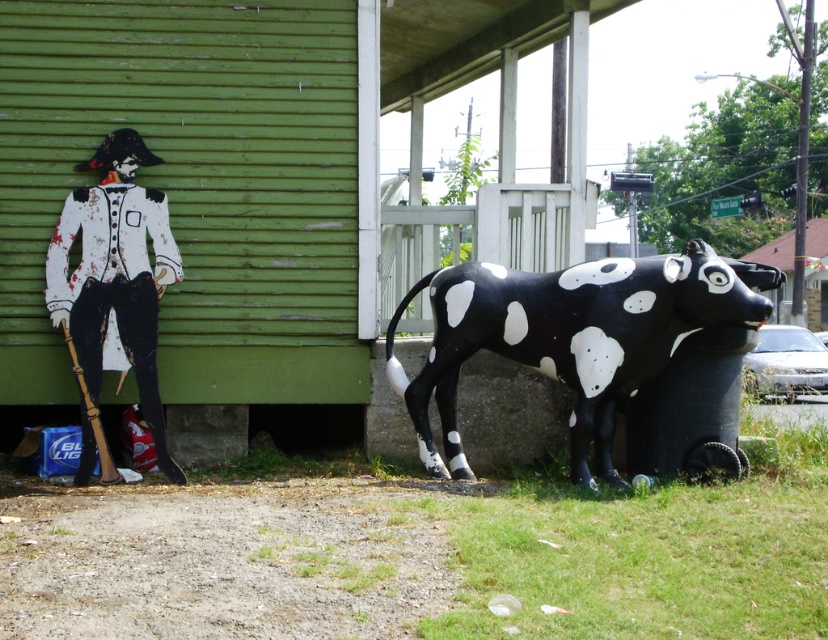
Question: Is black glossy plastic bull at lower right closer to camera compared to white painted wood at left?

Choices:
 (A) yes
 (B) no

Answer: (A)

Question: Which point appears closest to the camera in this image?

Choices:
 (A) (623, 372)
 (B) (133, 276)

Answer: (A)

Question: Is black glossy plastic bull at lower right smaller than white painted wood at left?

Choices:
 (A) no
 (B) yes

Answer: (A)

Question: Is black glossy plastic bull at lower right wider than white painted wood at left?

Choices:
 (A) no
 (B) yes

Answer: (B)

Question: Which of the following is the farthest from the observer?

Choices:
 (A) black glossy plastic bull at lower right
 (B) white painted wood at left

Answer: (B)